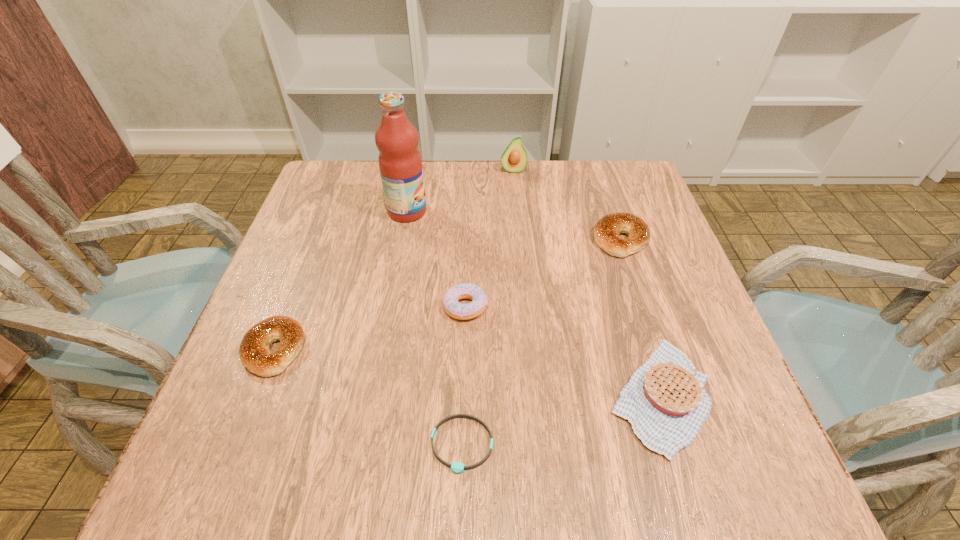
I want to click on the tallest object, so click(x=400, y=163).

Image resolution: width=960 pixels, height=540 pixels. I want to click on the sixth object from right to left, so click(400, 163).

Locate an element on the screen. This screenshot has width=960, height=540. the farthest object is located at coordinates (514, 159).

Find the location of `avocado`. avocado is located at coordinates (514, 159).

I want to click on the right bagel, so click(606, 231).

Find the location of a particular element. The image size is (960, 540). doughnut is located at coordinates pos(453,308).

What are the coordinates of `the nearer bagel` in the screenshot? It's located at (255, 355).

You are a GUI agent. You are given a task and a screenshot of the screen. Output one action in this format:
    pyautogui.click(x=<x>, y=<y>)
    Task: Click on the leftmost object
    
    Given the screenshot: What is the action you would take?
    pyautogui.click(x=255, y=355)

The height and width of the screenshot is (540, 960). Identify the location of pie. (665, 401).

Where is `the shortest object`? the shortest object is located at coordinates (456, 467).